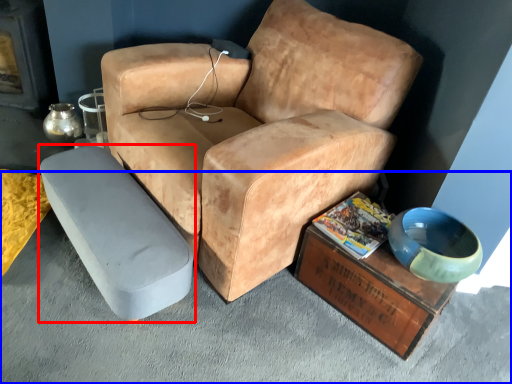
Question: Which object appears farthest to the camera in this image, table (highlighted by a red box) or concrete (highlighted by a blue box)?

Choices:
 (A) table
 (B) concrete

Answer: (A)